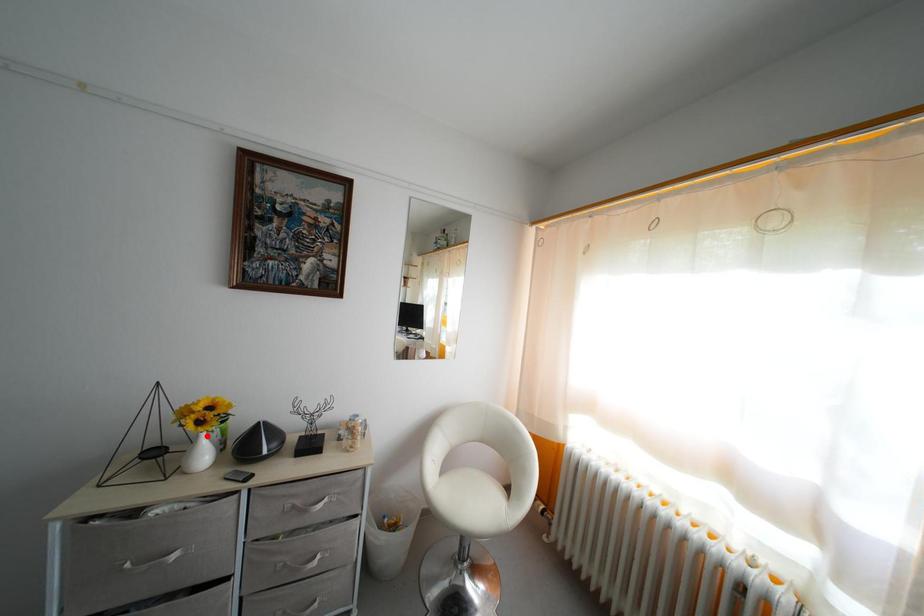
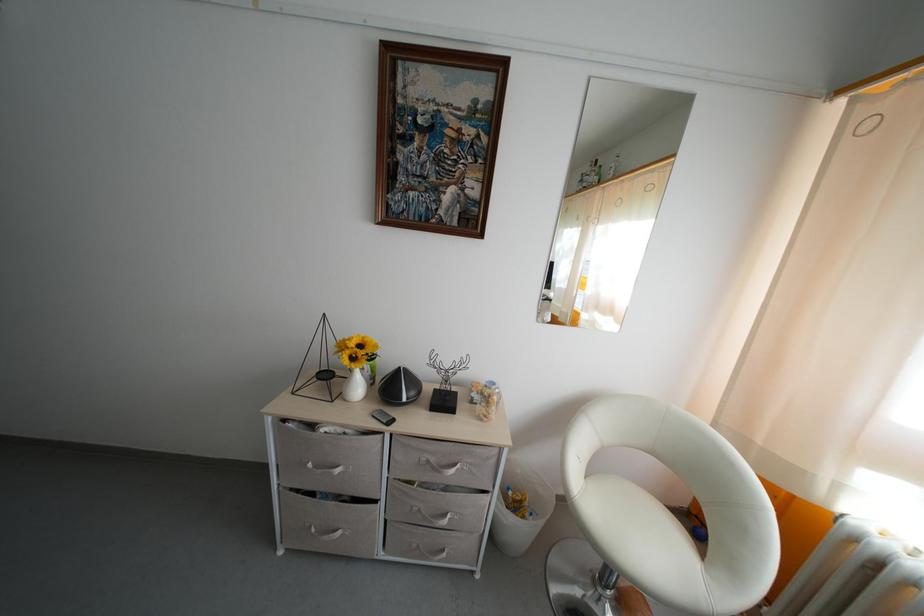
In the second image, find the point that corresponds to the highlighted location in the first image.

(359, 371)